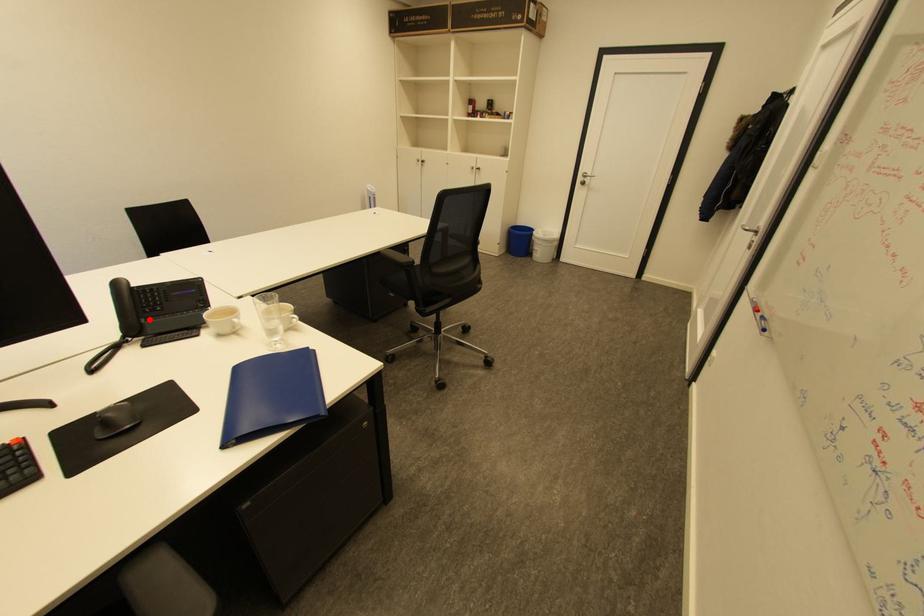
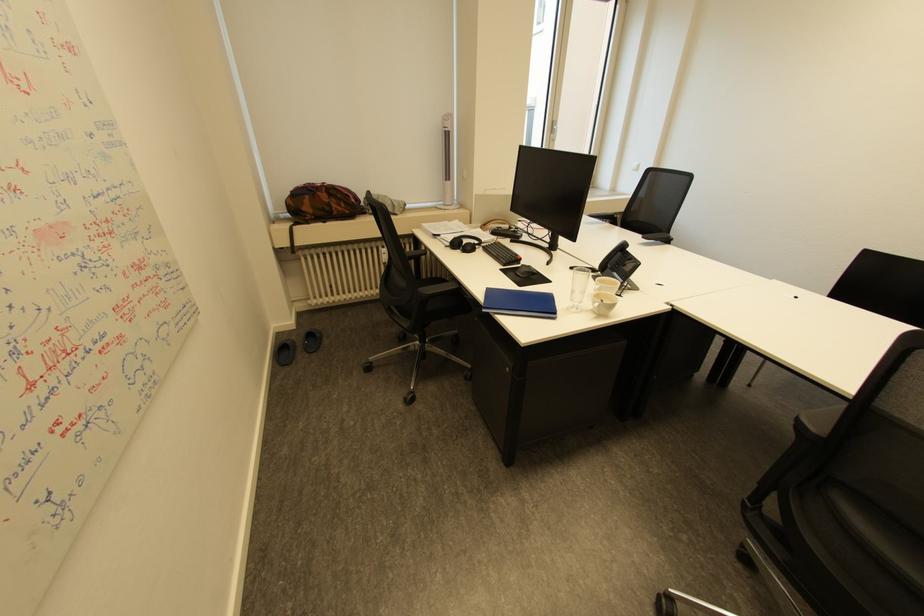
The point at the highlighted location is marked in the first image. Where is the corresponding point in the second image?

(616, 267)